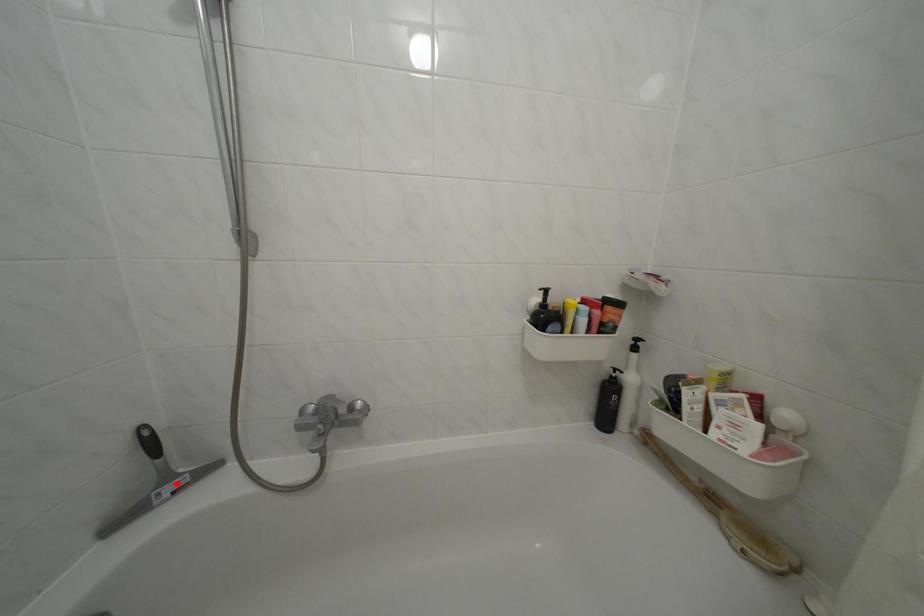
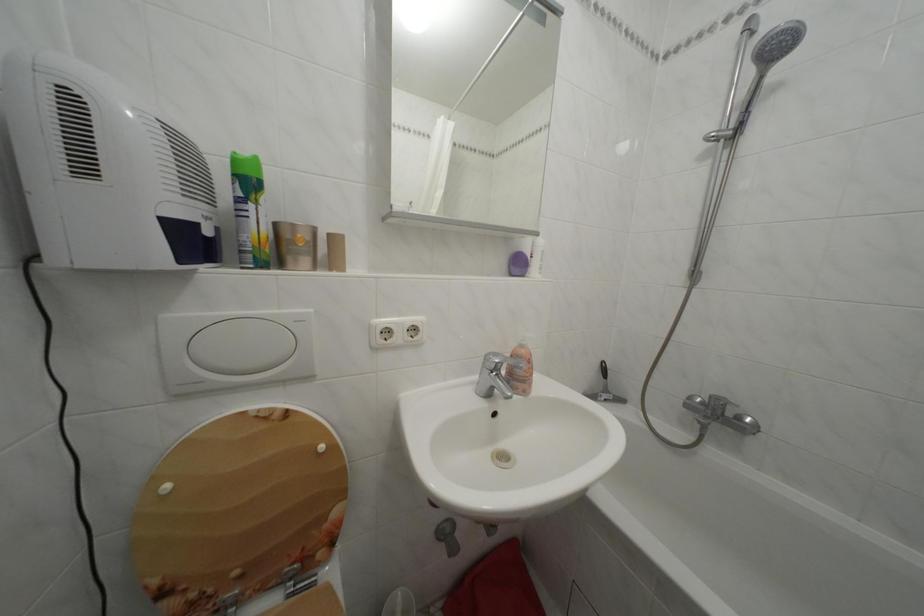
Question: A red point is marked in image1. In image2, is the corresponding 3D point closer to the camera or farther? Reply with the corresponding letter.

Choices:
 (A) The corresponding 3D point is closer.
 (B) The corresponding 3D point is farther.

Answer: (B)